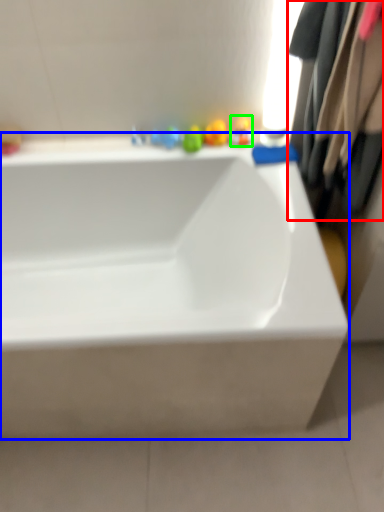
Question: Which object is the farthest from clothing (highlighted by a red box)? Choose among these: bathtub (highlighted by a blue box) or toy (highlighted by a green box).

Choices:
 (A) bathtub
 (B) toy

Answer: (A)